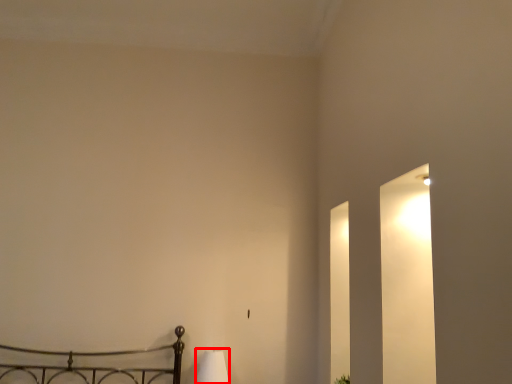
Question: Where is lamp (annotated by the red box) located in relation to plant in the image?

Choices:
 (A) right
 (B) left

Answer: (B)